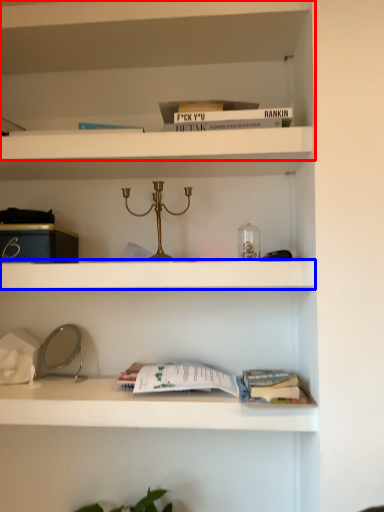
Question: Which object is further to the camera taking this photo, shelf (highlighted by a red box) or cabinet (highlighted by a blue box)?

Choices:
 (A) shelf
 (B) cabinet

Answer: (A)